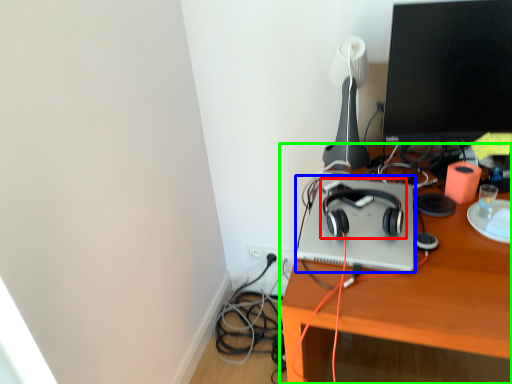
Question: Considering the real-world distances, which object is closest to headphones (highlighted by a red box)? computer (highlighted by a blue box) or desk (highlighted by a green box).

Choices:
 (A) computer
 (B) desk

Answer: (A)